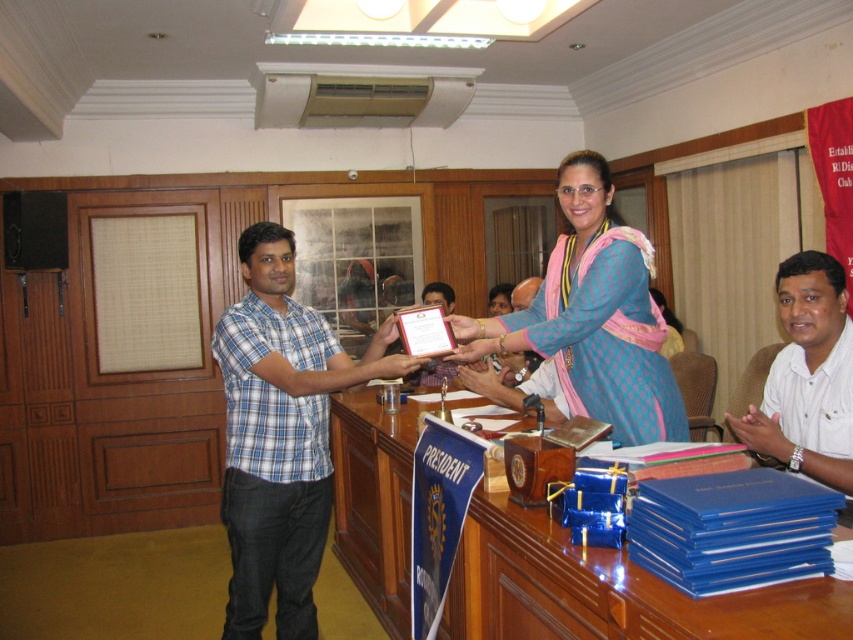
Question: Which of the following is the closest to the observer?

Choices:
 (A) (287, 296)
 (B) (775, 396)
 (C) (405, 456)

Answer: (B)

Question: Considering the real-world distances, which object is closest to the blue silk saree at center?

Choices:
 (A) shiny wooden table at center
 (B) white matte shirt at lower right
 (C) blue plaid shirt at center

Answer: (B)

Question: Is shiny wooden table at center bigger than blue plaid shirt at center?

Choices:
 (A) yes
 (B) no

Answer: (A)

Question: Is shiny wooden table at center further to camera compared to white matte shirt at lower right?

Choices:
 (A) yes
 (B) no

Answer: (A)

Question: Which object is positioned closest to the shiny wooden table at center?

Choices:
 (A) blue silk saree at center
 (B) white matte shirt at lower right

Answer: (A)

Question: Does blue plaid shirt at center have a lesser width compared to white matte shirt at lower right?

Choices:
 (A) yes
 (B) no

Answer: (B)